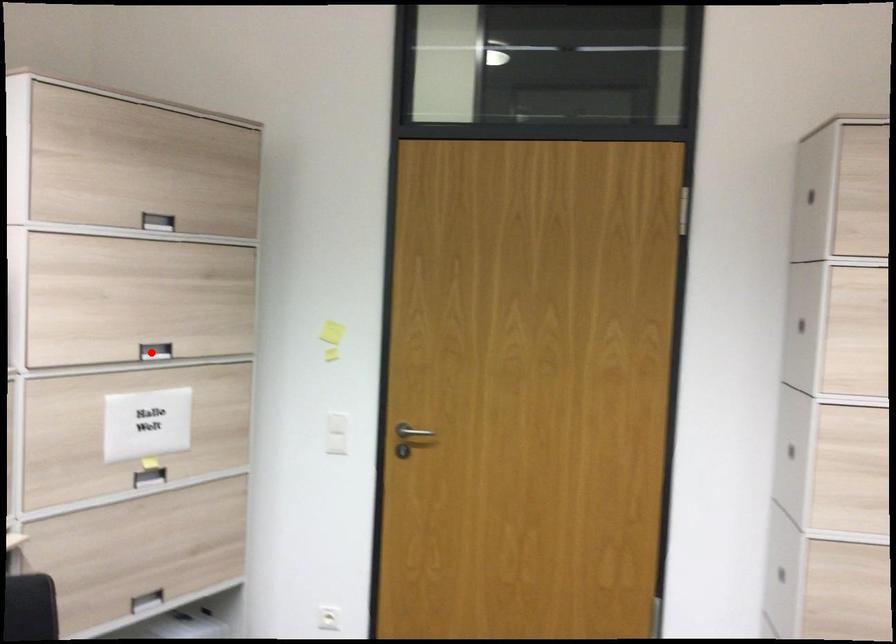
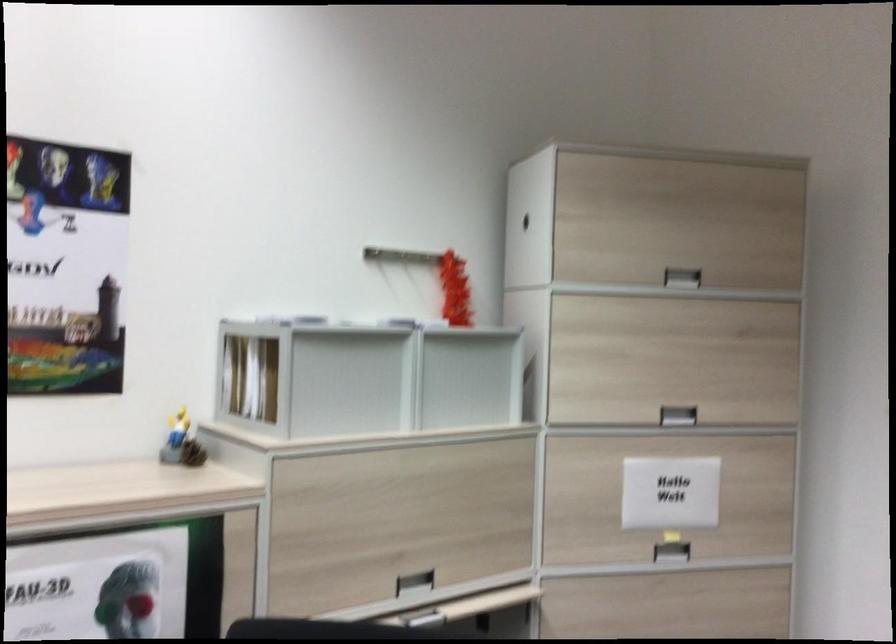
Question: I am providing you with two images of the same scene from different viewpoints. A red point is shown in image1. For the corresponding object point in image2, is it positioned nearer or farther from the camera?

Choices:
 (A) Nearer
 (B) Farther

Answer: (A)